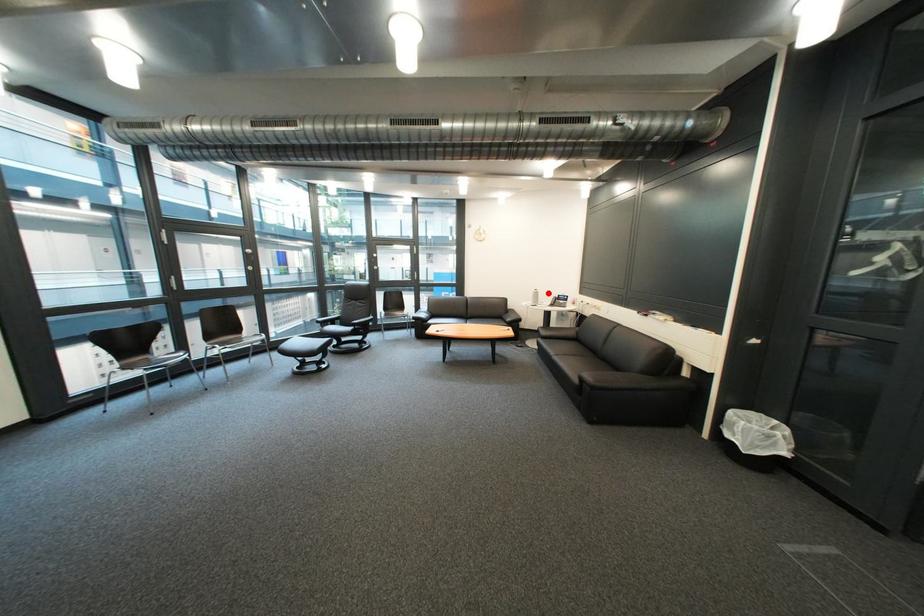
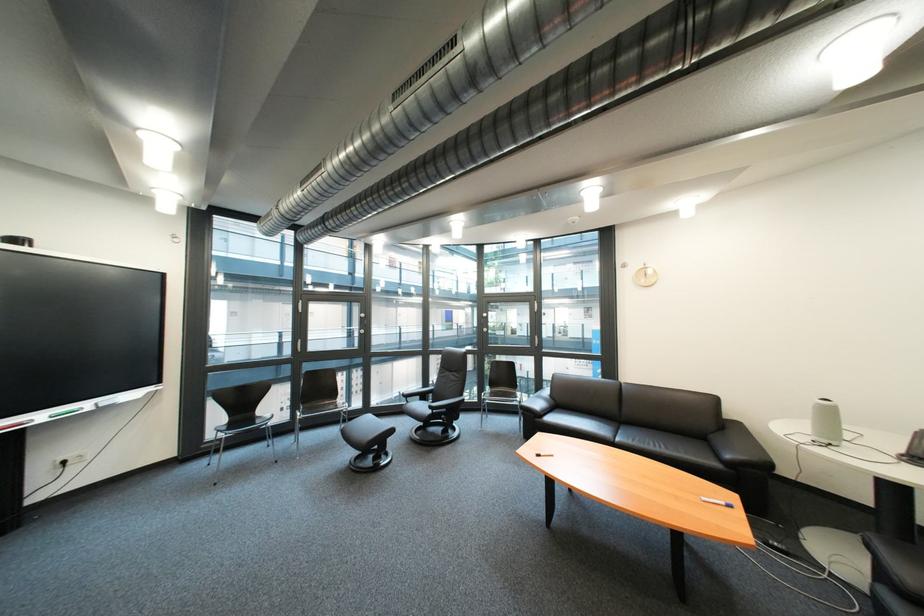
Where in the second image is the point corresponding to the highlighted location from the first image?

(833, 406)